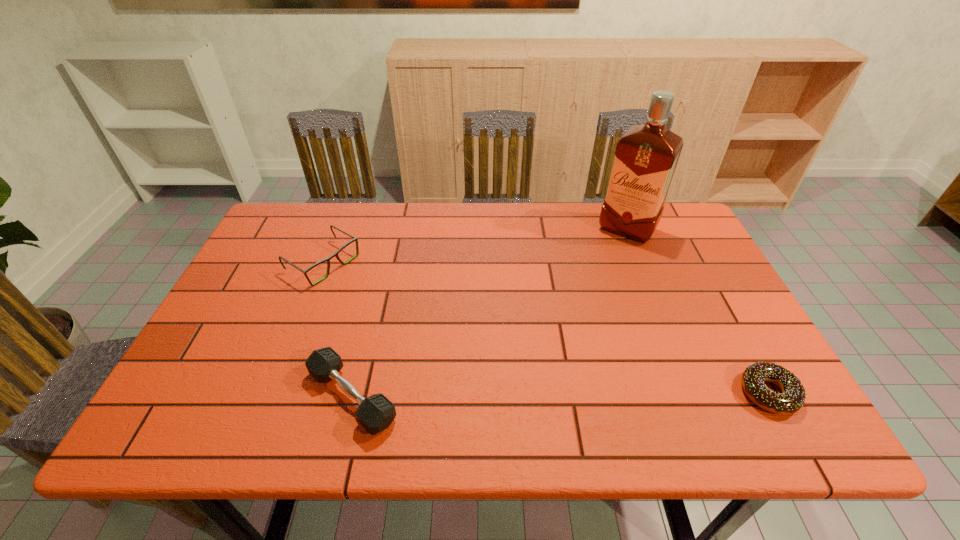
Find the location of a particular element. free space on the desktop that is between the dumbbell and the rightmost object and is positioned on the front label of the second object from right to left is located at coordinates (518, 395).

Locate an element on the screen. The height and width of the screenshot is (540, 960). vacant spot on the desktop that is between the dumbbell and the doughnut and is positioned on the lens of the spectacles is located at coordinates (541, 395).